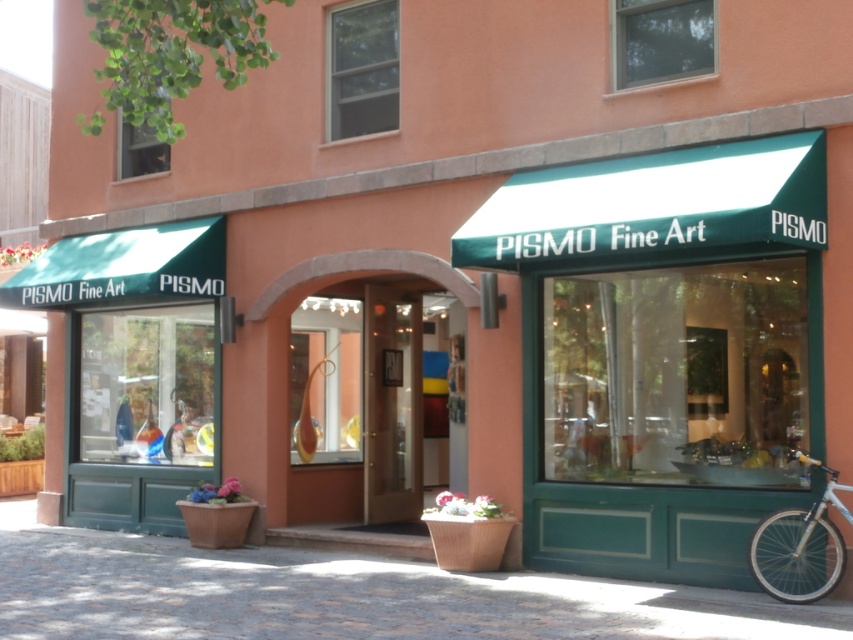
Who is positioned more to the left, cobblestone pavement at lower center or white metallic bicycle at lower right?

From the viewer's perspective, cobblestone pavement at lower center appears more on the left side.

Looking at this image, does cobblestone pavement at lower center appear on the right side of white metallic bicycle at lower right?

In fact, cobblestone pavement at lower center is to the left of white metallic bicycle at lower right.

Where is `cobblestone pavement at lower center`? The width and height of the screenshot is (853, 640). cobblestone pavement at lower center is located at coordinates (346, 596).